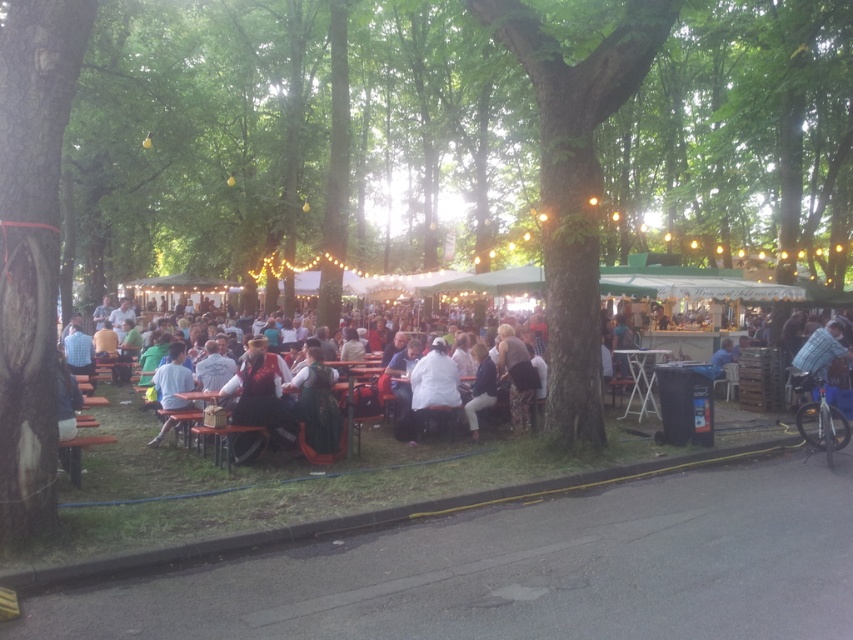
You are organizing a seating arrangement for an outdoor event and notice a wooden chair at center and a dark brown leather jacket at center. Which object takes up more space in the area?

The wooden chair at center is larger in size than the dark brown leather jacket at center, so it takes up more space.

You are standing at the entrance of the park and see the green rough bark tree at left and the light blue shirt at center. Which object is closer to your left side?

The light blue shirt at center is closer to your left side because the green rough bark tree at left is to the right of it, meaning the light blue shirt at center is positioned to the left of the tree.